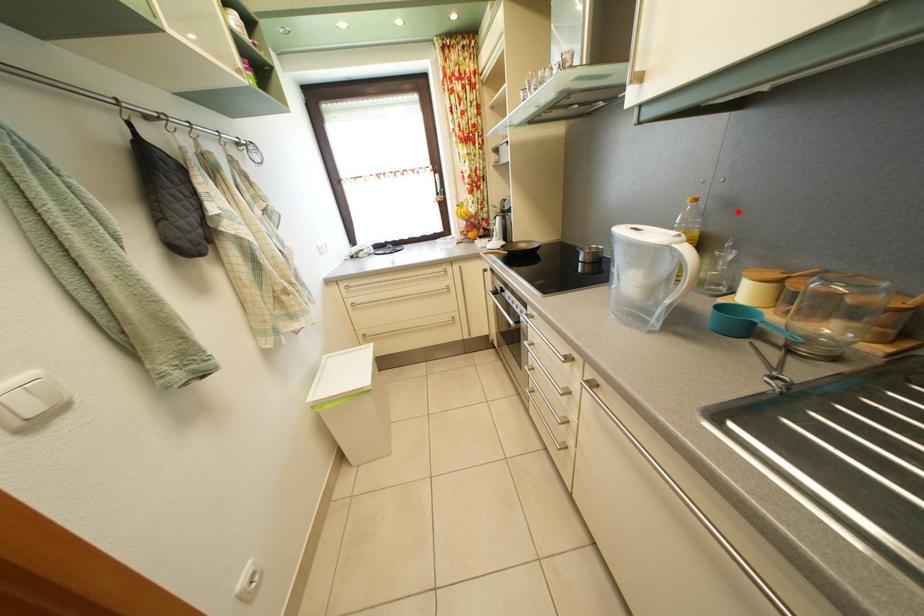
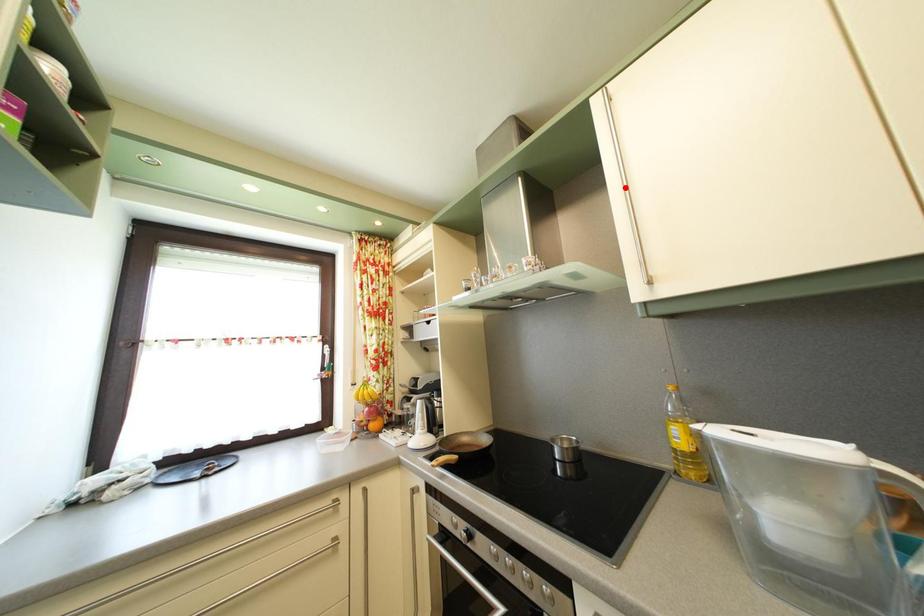
I am providing you with two images of the same scene from different viewpoints. A red point is marked on the first image and another point is marked on the second image. Does the point marked in image1 correspond to the same location as the one in image2?

No